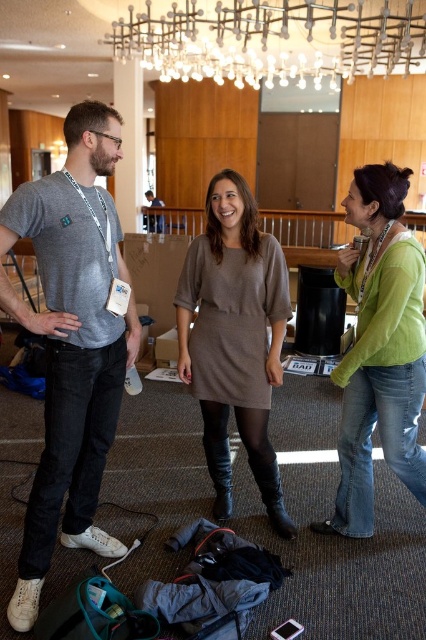
You are at a conference and want to approach the two people at the center. Which direction should you move relative to the dark gray fabric shirt at center to reach the green knitwear at center?

The green knitwear at center is to the right of the dark gray fabric shirt at center, so you should move to the right of the dark gray fabric shirt at center to reach the green knitwear at center.

You are standing in the hotel lobby and want to take a photo of the point at coordinates (83, 272). Your camera has a maximum focus range of 2 meters. Will the camera be able to focus on the point?

The point at coordinates (83, 272) is 1.90 meters from the camera, which is within the maximum focus range of 2 meters. Therefore, the camera can focus on the point.